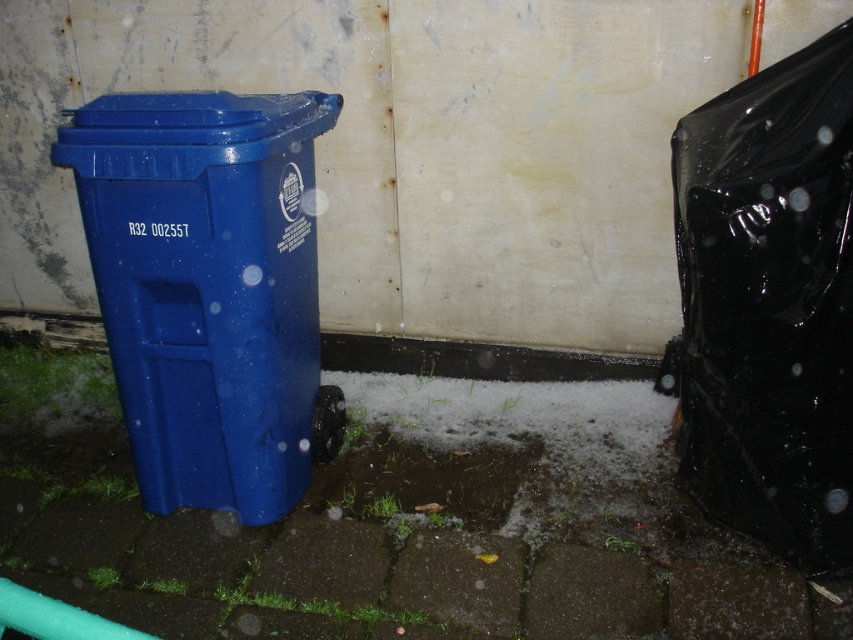
Question: Among these points, which one is nearest to the camera?

Choices:
 (A) (131, 465)
 (B) (711, 387)

Answer: (B)

Question: Does smooth concrete pavement at center have a larger size compared to matte plastic recycling bin at left?

Choices:
 (A) yes
 (B) no

Answer: (A)

Question: Which point appears closest to the camera in this image?

Choices:
 (A) (757, 417)
 (B) (257, 385)
 (C) (381, 595)

Answer: (A)

Question: Which point appears closest to the camera in this image?

Choices:
 (A) (320, 548)
 (B) (230, 476)

Answer: (A)

Question: Is the position of smooth concrete pavement at center more distant than that of matte plastic recycling bin at left?

Choices:
 (A) no
 (B) yes

Answer: (A)

Question: Does smooth concrete pavement at center come behind black glossy trash bag at right?

Choices:
 (A) no
 (B) yes

Answer: (B)